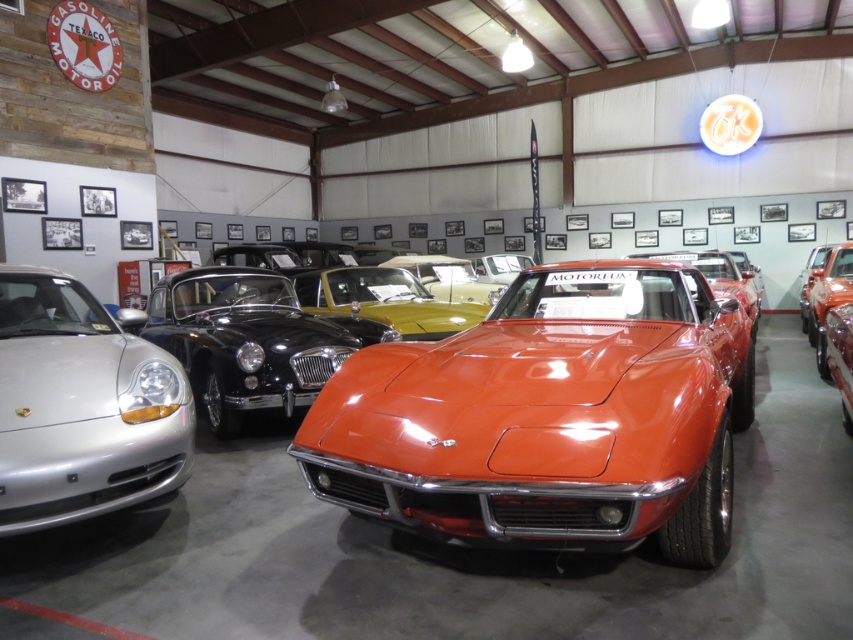
Can you confirm if glossy orange sports car at center is thinner than satin silver porsche at left?

No.

Between glossy orange sports car at center and satin silver porsche at left, which one has more height?

glossy orange sports car at center is taller.

This screenshot has height=640, width=853. Find the location of `glossy orange sports car at center`. glossy orange sports car at center is located at coordinates (549, 417).

Where is `glossy orange sports car at center`? The height and width of the screenshot is (640, 853). glossy orange sports car at center is located at coordinates (549, 417).

Who is lower down, glossy orange car at center or satin silver porsche at left?

satin silver porsche at left is below.

Can you confirm if glossy orange car at center is shorter than satin silver porsche at left?

No, glossy orange car at center is not shorter than satin silver porsche at left.

Is point (712, 428) positioned behind point (68, 476)?

No, it is in front of (68, 476).

Identify the location of glossy orange car at center. The height and width of the screenshot is (640, 853). (547, 419).

Between point (312, 422) and point (496, 333), which one is positioned behind?

Positioned behind is point (496, 333).

Which is in front, point (608, 294) or point (705, 330)?

Positioned in front is point (705, 330).

Where is `glossy orange car at center`? Image resolution: width=853 pixels, height=640 pixels. glossy orange car at center is located at coordinates (547, 419).